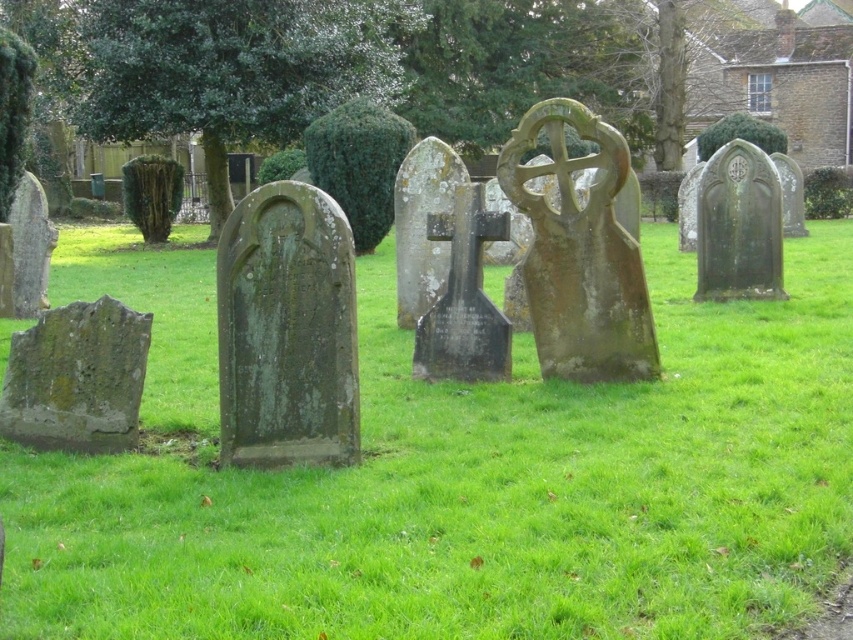
Question: Does green mossy grass at center have a greater width compared to green stone gravestone at right?

Choices:
 (A) yes
 (B) no

Answer: (A)

Question: Does green mossy gravestone at center appear over green mossy stone at lower left?

Choices:
 (A) no
 (B) yes

Answer: (B)

Question: Which of the following is the farthest from the observer?

Choices:
 (A) (351, 280)
 (B) (566, 620)

Answer: (A)

Question: Which of the following is the farthest from the observer?

Choices:
 (A) (782, 368)
 (B) (258, 419)
 (C) (28, 348)

Answer: (A)

Question: Is green mossy grass at center to the right of green stone gravestone at right from the viewer's perspective?

Choices:
 (A) no
 (B) yes

Answer: (A)

Question: Which object appears closest to the camera in this image?

Choices:
 (A) green mossy gravestone at center
 (B) green mossy grass at center
 (C) green mossy stone at lower left
 (D) green stone gravestone at right

Answer: (B)